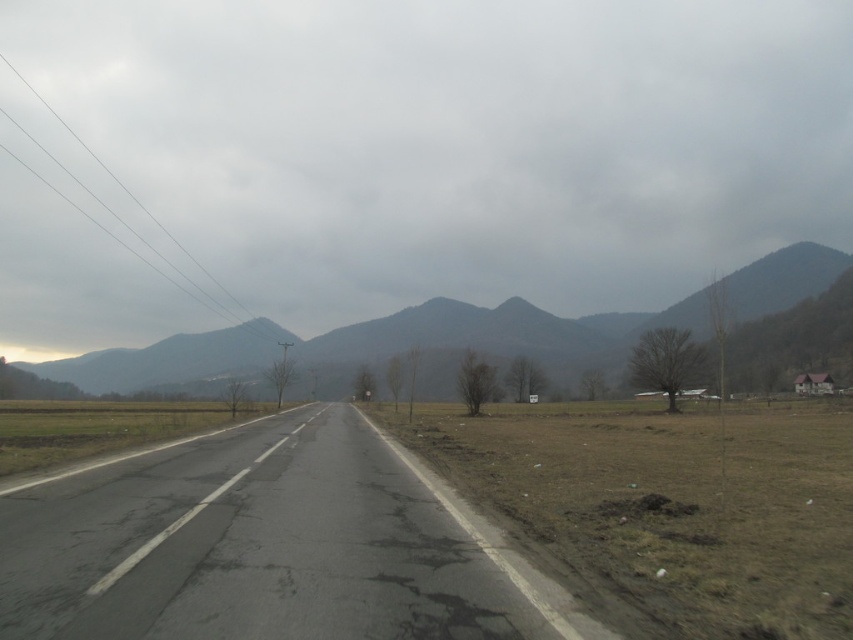
Question: Is gray cloudy sky at upper center further to the viewer compared to gray rocky mountain at center?

Choices:
 (A) no
 (B) yes

Answer: (B)

Question: Can you confirm if asphalt road at center is positioned below gray rocky mountain at center?

Choices:
 (A) yes
 (B) no

Answer: (B)

Question: Which point is farther to the camera?

Choices:
 (A) gray cloudy sky at upper center
 (B) gray rocky mountain at center

Answer: (A)

Question: Which point appears farthest from the camera in this image?

Choices:
 (A) (189, 339)
 (B) (82, 221)

Answer: (B)

Question: Is gray cloudy sky at upper center behind asphalt road at center?

Choices:
 (A) no
 (B) yes

Answer: (B)

Question: Estimate the real-world distances between objects in this image. Which object is closer to the asphalt road at center?

Choices:
 (A) gray rocky mountain at center
 (B) gray cloudy sky at upper center

Answer: (A)